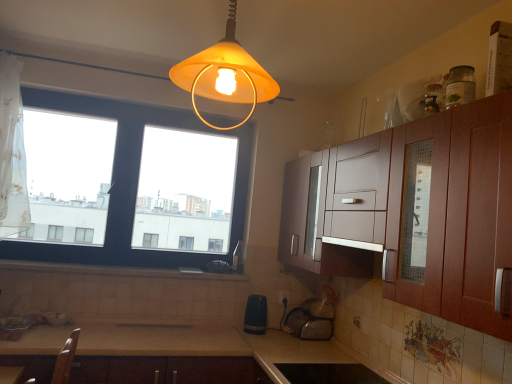
Question: In which direction should I rotate to look at matte white electric outlet at lower center?

Choices:
 (A) right
 (B) left

Answer: (A)

Question: Which direction should I rotate to look at black matte stove at lower center, the 4th appliance in the top-to-bottom sequence?

Choices:
 (A) left
 (B) right

Answer: (B)

Question: Can you confirm if white sheer curtain at left is wider than matte yellow glass lampshade at upper center?

Choices:
 (A) no
 (B) yes

Answer: (B)

Question: Can we say white sheer curtain at left lies outside matte yellow glass lampshade at upper center?

Choices:
 (A) yes
 (B) no

Answer: (A)

Question: Would you say white sheer curtain at left contains matte yellow glass lampshade at upper center?

Choices:
 (A) no
 (B) yes

Answer: (A)

Question: From the image's perspective, would you say white sheer curtain at left is positioned over matte yellow glass lampshade at upper center?

Choices:
 (A) yes
 (B) no

Answer: (B)

Question: Is white sheer curtain at left in front of matte yellow glass lampshade at upper center?

Choices:
 (A) no
 (B) yes

Answer: (A)

Question: Does white sheer curtain at left appear on the right side of matte yellow glass lampshade at upper center?

Choices:
 (A) no
 (B) yes

Answer: (A)

Question: Does black plastic toaster at lower center, which is counted as the second appliance, starting from the back, come behind matte yellow glass lampshade at upper center?

Choices:
 (A) no
 (B) yes

Answer: (B)

Question: From a real-world perspective, is black plastic toaster at lower center, placed as the third appliance when sorted from bottom to top, over matte yellow glass lampshade at upper center?

Choices:
 (A) no
 (B) yes

Answer: (A)

Question: Is matte yellow glass lampshade at upper center surrounded by black plastic toaster at lower center, positioned as the third appliance in front-to-back order?

Choices:
 (A) yes
 (B) no

Answer: (B)

Question: Can you confirm if black plastic toaster at lower center, which is counted as the second appliance, starting from the back, is shorter than matte yellow glass lampshade at upper center?

Choices:
 (A) no
 (B) yes

Answer: (B)

Question: Considering the relative sizes of black plastic toaster at lower center, positioned as the third appliance in front-to-back order, and matte yellow glass lampshade at upper center in the image provided, is black plastic toaster at lower center, positioned as the third appliance in front-to-back order, taller than matte yellow glass lampshade at upper center?

Choices:
 (A) no
 (B) yes

Answer: (A)

Question: Considering the relative sizes of black plastic toaster at lower center, positioned as the third appliance in front-to-back order, and matte yellow glass lampshade at upper center in the image provided, is black plastic toaster at lower center, positioned as the third appliance in front-to-back order, wider than matte yellow glass lampshade at upper center?

Choices:
 (A) yes
 (B) no

Answer: (B)

Question: Are beige laminate countertop at lower center and matte yellow glass lampshade at upper center beside each other?

Choices:
 (A) yes
 (B) no

Answer: (B)